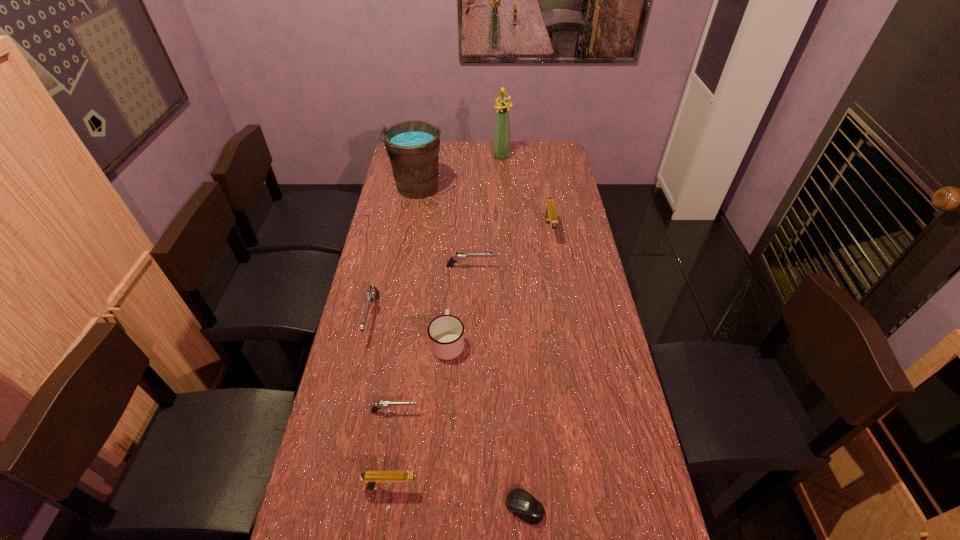
Find the location of `free space that is in between the bouquet and the tallest pistol`. free space that is in between the bouquet and the tallest pistol is located at coordinates coord(525,194).

This screenshot has height=540, width=960. I want to click on free space between the second shortest pistol and the farthest object, so click(x=486, y=212).

Point out which object is positioned as the seventh nearest to the black mouse. Please provide its 2D coordinates. Your answer should be formatted as a tuple, i.e. [(x, y)], where the tuple contains the x and y coordinates of a point satisfying the conditions above.

[(413, 147)]

Identify which object is the fifth nearest to the mug. Please provide its 2D coordinates. Your answer should be formatted as a tuple, i.e. [(x, y)], where the tuple contains the x and y coordinates of a point satisfying the conditions above.

[(519, 502)]

Where is `pistol that can be found as the closest to the green bouquet`? The height and width of the screenshot is (540, 960). pistol that can be found as the closest to the green bouquet is located at coordinates (550, 215).

Where is `the third closest pistol to the nearest pistol`? The image size is (960, 540). the third closest pistol to the nearest pistol is located at coordinates pyautogui.click(x=459, y=256).

Identify the location of silver pistol that is the second closest to the fourth nearest pistol. (386, 404).

Identify the location of the second closest silver pistol to the green bouquet. (373, 293).

Image resolution: width=960 pixels, height=540 pixels. Identify the location of free space that satisfies the following two spatial constraints: 1. on the front-facing side of the black mouse; 2. on the right side of the second smallest silver pistol. (466, 508).

This screenshot has height=540, width=960. Find the location of `free space in the image that satisfies the following two spatial constraints: 1. at the barrel of the shortest object; 2. on the right side of the left tan pistol`. free space in the image that satisfies the following two spatial constraints: 1. at the barrel of the shortest object; 2. on the right side of the left tan pistol is located at coordinates (388, 508).